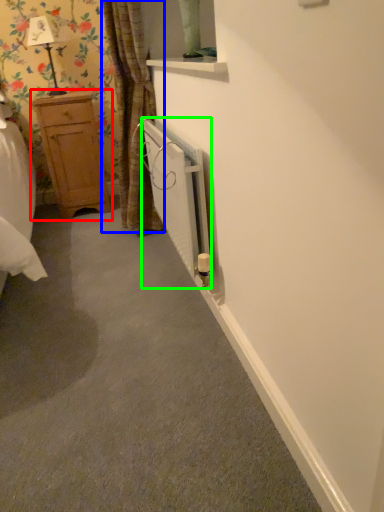
Question: Which object is positioned farthest from dresser (highlighted by a red box)? Select from curtain (highlighted by a blue box) and radiator (highlighted by a green box).

Choices:
 (A) curtain
 (B) radiator

Answer: (B)